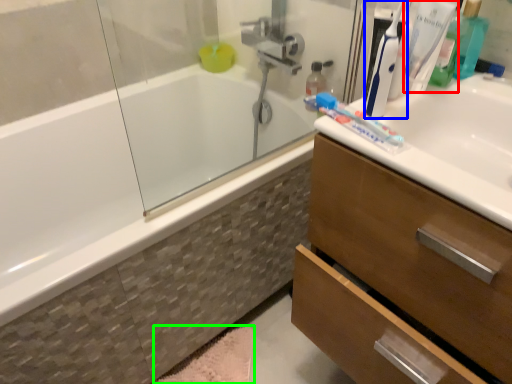
Question: Considering the real-world distances, which object is closest to toothbrush (highlighted by a red box)? toothbrush (highlighted by a blue box) or bath mat (highlighted by a green box).

Choices:
 (A) toothbrush
 (B) bath mat

Answer: (A)